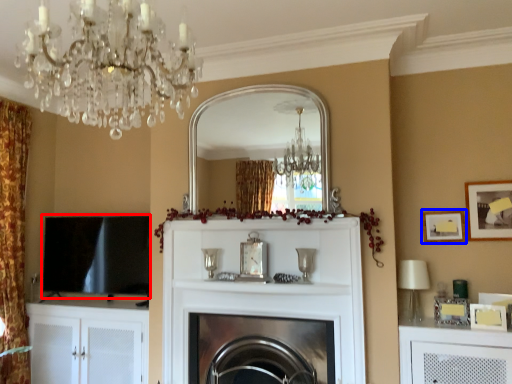
Question: Which object appears closest to the camera in this image, window screen (highlighted by a red box) or picture frame (highlighted by a blue box)?

Choices:
 (A) window screen
 (B) picture frame

Answer: (B)